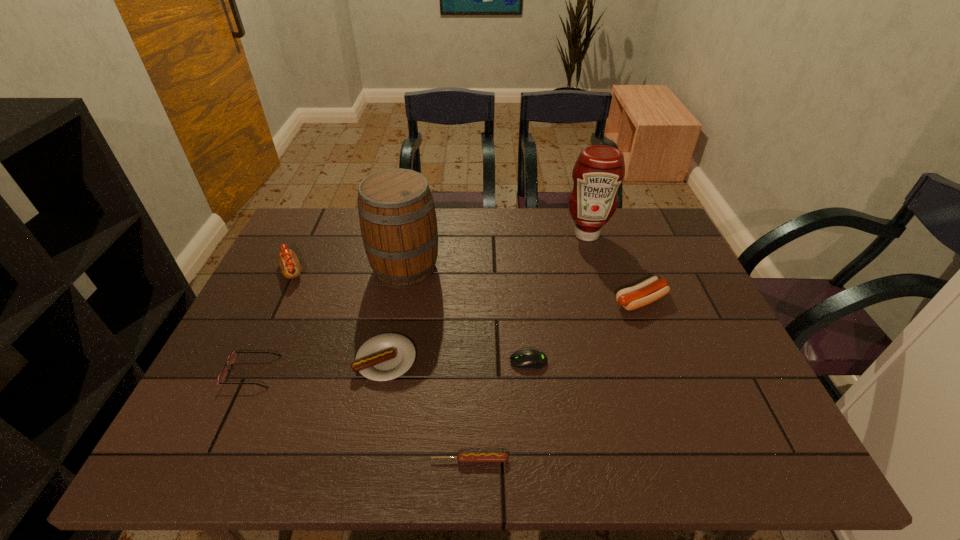
I want to click on free space located 0.360m on the left of the nearest object, so click(252, 460).

The image size is (960, 540). Find the location of `condiment located in the far edge section of the desktop`. condiment located in the far edge section of the desktop is located at coordinates (599, 170).

You are a GUI agent. You are given a task and a screenshot of the screen. Output one action in this format:
    pyautogui.click(x=<x>, y=<y>)
    Task: Click on the cider that is at the far edge
    
    Given the screenshot: What is the action you would take?
    pyautogui.click(x=398, y=222)

Find the location of `object present at the near edge`. object present at the near edge is located at coordinates (463, 457).

Image resolution: width=960 pixels, height=540 pixels. What are the coordinates of `sausage that is at the left edge` in the screenshot? It's located at 288,261.

Where is `sunglasses positioned at the left edge`? Image resolution: width=960 pixels, height=540 pixels. sunglasses positioned at the left edge is located at coordinates (232, 358).

What are the coordinates of `object located in the right edge section of the desktop` in the screenshot? It's located at (651, 289).

Identify the location of blank space at the far edge of the desktop. (440, 251).

I want to click on free space at the near edge of the desktop, so click(x=318, y=436).

In the image, there is a desktop. Where is `free space at the left edge`? This screenshot has width=960, height=540. free space at the left edge is located at coordinates (263, 409).